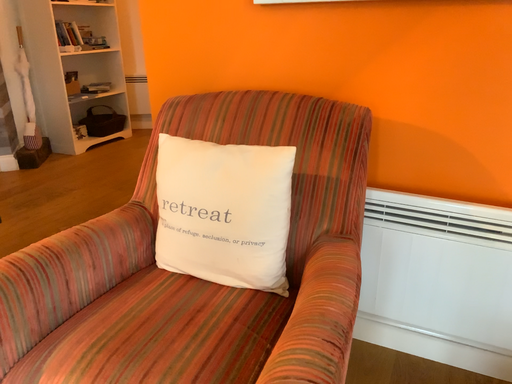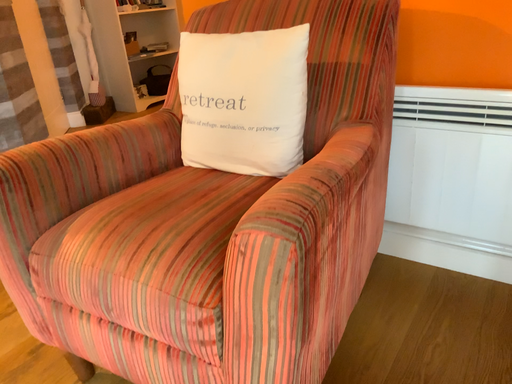
Question: How did the camera likely rotate when shooting the video?

Choices:
 (A) rotated right
 (B) rotated left

Answer: (B)